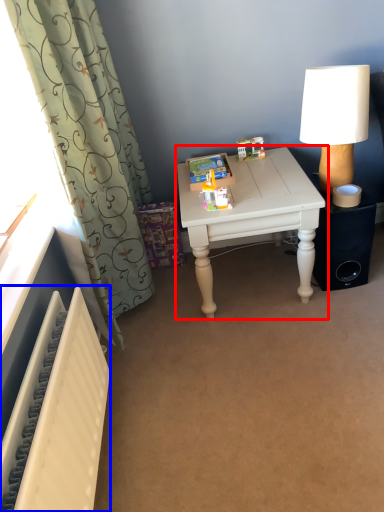
Question: Among these objects, which one is nearest to the camera, table (highlighted by a red box) or radiator (highlighted by a blue box)?

Choices:
 (A) table
 (B) radiator

Answer: (B)